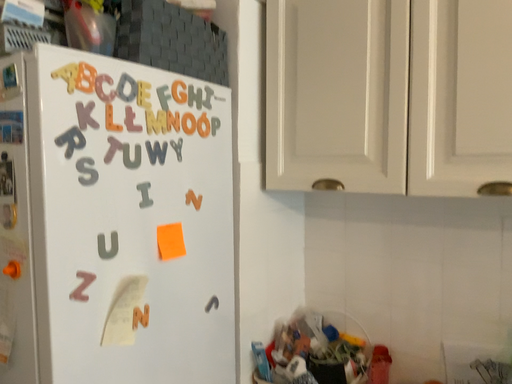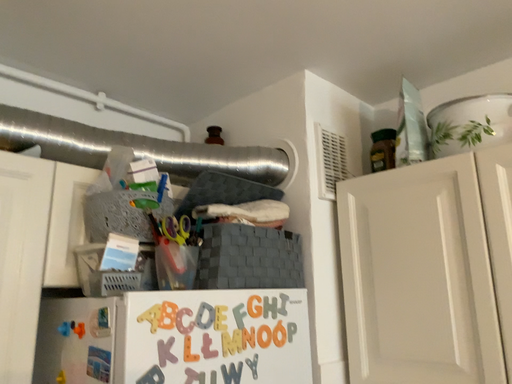
Question: Which way did the camera rotate in the video?

Choices:
 (A) rotated upward
 (B) rotated downward

Answer: (A)